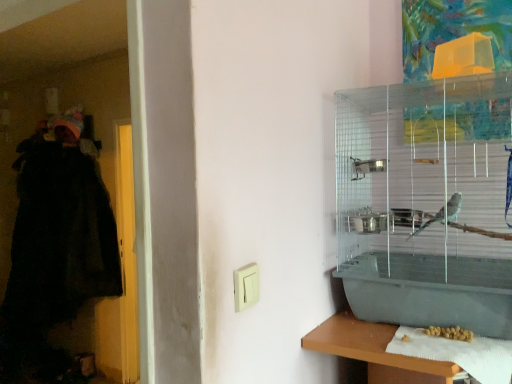
What is the approximate width of white paper towel at lower right?

white paper towel at lower right is 8.47 inches in width.

What are the coordinates of `white plastic light switch at center` in the screenshot? It's located at (246, 286).

What is the approximate height of yellow matte seeds at lower right?

The height of yellow matte seeds at lower right is 1.12 inches.

This screenshot has height=384, width=512. What are the coordinates of `clear plastic birdcage at upper right` in the screenshot? It's located at pos(426,202).

The height and width of the screenshot is (384, 512). Describe the element at coordinates (60, 239) in the screenshot. I see `black fuzzy robe at left` at that location.

Where is `white paper towel at lower right`? This screenshot has width=512, height=384. white paper towel at lower right is located at coordinates (375, 351).

Does white plastic light switch at center come behind clear plastic birdcage at upper right?

That is False.

Does white plastic light switch at center have a lesser height compared to clear plastic birdcage at upper right?

Indeed, white plastic light switch at center has a lesser height compared to clear plastic birdcage at upper right.

Is clear plastic birdcage at upper right surrounded by white plastic light switch at center?

No, clear plastic birdcage at upper right is not a part of white plastic light switch at center.

Can you tell me how much black fuzzy robe at left and yellow matte seeds at lower right differ in facing direction?

The angular difference between black fuzzy robe at left and yellow matte seeds at lower right is 11.3 degrees.

Which object is positioned more to the left, black fuzzy robe at left or yellow matte seeds at lower right?

Positioned to the left is black fuzzy robe at left.

Is black fuzzy robe at left wider or thinner than yellow matte seeds at lower right?

Considering their sizes, black fuzzy robe at left looks broader than yellow matte seeds at lower right.

Is the position of black fuzzy robe at left more distant than that of yellow matte seeds at lower right?

Yes, it is.

Where is `light switch located on the left of yellow matte seeds at lower right`? light switch located on the left of yellow matte seeds at lower right is located at coordinates (246, 286).

Can you confirm if white plastic light switch at center is shorter than yellow matte seeds at lower right?

No.

Considering the relative positions of white plastic light switch at center and yellow matte seeds at lower right in the image provided, is white plastic light switch at center to the left or to the right of yellow matte seeds at lower right?

Based on their positions, white plastic light switch at center is located to the left of yellow matte seeds at lower right.

Which of these two, white plastic light switch at center or yellow matte seeds at lower right, is bigger?

yellow matte seeds at lower right is bigger.

Is black fuzzy robe at left behind white plastic light switch at center?

Yes, it is behind white plastic light switch at center.

Could you tell me if black fuzzy robe at left is turned towards white plastic light switch at center?

A: No.

In the scene shown: Which object is positioned more to the right, black fuzzy robe at left or white plastic light switch at center?

white plastic light switch at center is more to the right.

Which object is positioned more to the right, yellow matte seeds at lower right or white paper towel at lower right?

yellow matte seeds at lower right is more to the right.

How different are the orientations of yellow matte seeds at lower right and white paper towel at lower right in degrees?

The facing directions of yellow matte seeds at lower right and white paper towel at lower right are 4.3 degrees apart.

How far apart are yellow matte seeds at lower right and white paper towel at lower right?

yellow matte seeds at lower right is 7.02 inches away from white paper towel at lower right.

Based on the photo, from the image's perspective, which object appears higher, yellow matte seeds at lower right or white paper towel at lower right?

yellow matte seeds at lower right.

From the image's perspective, which is below, clear plastic birdcage at upper right or white paper towel at lower right?

white paper towel at lower right.

Is clear plastic birdcage at upper right bigger than white paper towel at lower right?

Yes.

Consider the image. Can you see clear plastic birdcage at upper right touching white paper towel at lower right?

clear plastic birdcage at upper right is not next to white paper towel at lower right, and they're not touching.

Which object is wider, clear plastic birdcage at upper right or white paper towel at lower right?

Wider between the two is clear plastic birdcage at upper right.

Can you tell me how much white paper towel at lower right and yellow matte seeds at lower right differ in facing direction?

white paper towel at lower right and yellow matte seeds at lower right are facing 4.3 degrees away from each other.

Which object is further away from the camera, white paper towel at lower right or yellow matte seeds at lower right?

yellow matte seeds at lower right is further away from the camera.

Can you see white paper towel at lower right touching yellow matte seeds at lower right?

No, white paper towel at lower right is not in contact with yellow matte seeds at lower right.

Based on their positions, is white paper towel at lower right located to the left or right of yellow matte seeds at lower right?

Clearly, white paper towel at lower right is on the left of yellow matte seeds at lower right in the image.

The height and width of the screenshot is (384, 512). I want to click on bird cage behind the white plastic light switch at center, so click(426, 202).

You are a GUI agent. You are given a task and a screenshot of the screen. Output one action in this format:
    pyautogui.click(x=<x>, y=<y>)
    Task: Click on the robe on the left of yellow matte seeds at lower right
    The image size is (512, 384).
    Given the screenshot: What is the action you would take?
    pyautogui.click(x=60, y=239)

From the image, which object appears to be farther from white paper towel at lower right, yellow matte seeds at lower right or black fuzzy robe at left?

black fuzzy robe at left.

Based on their spatial positions, is yellow matte seeds at lower right or clear plastic birdcage at upper right closer to white paper towel at lower right?

Based on the image, yellow matte seeds at lower right appears to be nearer to white paper towel at lower right.

In the scene shown: Estimate the real-world distances between objects in this image. Which object is closer to yellow matte seeds at lower right, black fuzzy robe at left or white plastic light switch at center?

white plastic light switch at center is closer to yellow matte seeds at lower right.

Looking at the image, which one is located further to black fuzzy robe at left, clear plastic birdcage at upper right or white plastic light switch at center?

white plastic light switch at center lies further to black fuzzy robe at left than the other object.

When comparing their distances from black fuzzy robe at left, does yellow matte seeds at lower right or clear plastic birdcage at upper right seem further?

Among the two, yellow matte seeds at lower right is located further to black fuzzy robe at left.

Based on their spatial positions, is black fuzzy robe at left or white plastic light switch at center closer to clear plastic birdcage at upper right?

white plastic light switch at center.

Which object lies further to the anchor point white plastic light switch at center, clear plastic birdcage at upper right or yellow matte seeds at lower right?

clear plastic birdcage at upper right is positioned further to the anchor white plastic light switch at center.

Based on their spatial positions, is white paper towel at lower right or black fuzzy robe at left further from clear plastic birdcage at upper right?

black fuzzy robe at left lies further to clear plastic birdcage at upper right than the other object.

Where is `shelf located between white plastic light switch at center and black fuzzy robe at left in the depth direction`? The height and width of the screenshot is (384, 512). shelf located between white plastic light switch at center and black fuzzy robe at left in the depth direction is located at coordinates (375, 351).

What are the coordinates of `shelf between white plastic light switch at center and yellow matte seeds at lower right` in the screenshot? It's located at (375, 351).

Locate an element on the screen. The height and width of the screenshot is (384, 512). food located between black fuzzy robe at left and clear plastic birdcage at upper right in the left-right direction is located at coordinates (450, 333).

Locate an element on the screen. food located between white plastic light switch at center and clear plastic birdcage at upper right in the left-right direction is located at coordinates (450, 333).